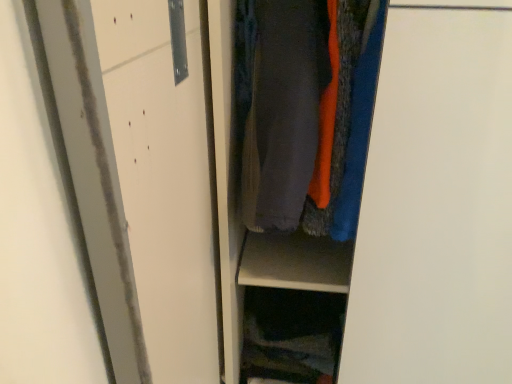
Measure the distance between point (x=246, y=152) and camera.

They are 27.76 inches apart.

Describe the element at coordinates (284, 112) in the screenshot. I see `dark gray fabric at center` at that location.

At what (x,y) coordinates should I click in order to perform the action: click on dark gray fabric at center. Please return your answer as a coordinate pair (x, y). Looking at the image, I should click on (284, 112).

This screenshot has width=512, height=384. What do you see at coordinates (292, 335) in the screenshot?
I see `dark fabric at lower center` at bounding box center [292, 335].

You are a GUI agent. You are given a task and a screenshot of the screen. Output one action in this format:
    pyautogui.click(x=<x>, y=<y>)
    Task: Click on the dark fabric at lower center
    The height and width of the screenshot is (384, 512).
    Given the screenshot: What is the action you would take?
    pyautogui.click(x=292, y=335)

The width and height of the screenshot is (512, 384). What are the coordinates of `dark gray fabric at center` in the screenshot? It's located at (284, 112).

Considering the positions of objects dark gray fabric at center and dark fabric at lower center in the image provided, who is more to the left, dark gray fabric at center or dark fabric at lower center?

dark fabric at lower center.

Relative to dark fabric at lower center, is dark gray fabric at center in front or behind?

Visually, dark gray fabric at center is located in front of dark fabric at lower center.

Which is behind, point (309, 97) or point (308, 339)?

The point (308, 339) is farther.

From the image's perspective, does dark gray fabric at center appear higher than dark fabric at lower center?

→ Indeed, from the image's perspective, dark gray fabric at center is shown above dark fabric at lower center.

From a real-world perspective, does dark gray fabric at center sit lower than dark fabric at lower center?

No, from a real-world perspective, dark gray fabric at center is not below dark fabric at lower center.

Is dark gray fabric at center thinner than dark fabric at lower center?

No.

From their relative heights in the image, would you say dark gray fabric at center is taller or shorter than dark fabric at lower center?

dark gray fabric at center is taller than dark fabric at lower center.

Considering the relative sizes of dark gray fabric at center and dark fabric at lower center in the image provided, is dark gray fabric at center bigger than dark fabric at lower center?

Indeed, dark gray fabric at center has a larger size compared to dark fabric at lower center.

Is dark gray fabric at center surrounding dark fabric at lower center?

Actually, dark fabric at lower center is outside dark gray fabric at center.

Does dark gray fabric at center touch dark fabric at lower center?

→ There is a gap between dark gray fabric at center and dark fabric at lower center.

Consider the image. Is dark gray fabric at center facing away from dark fabric at lower center?

dark gray fabric at center does not have its back to dark fabric at lower center.

I want to click on cabinet below the dark gray fabric at center (from the image's perspective), so click(x=292, y=335).

In the image, is dark fabric at lower center on the left side or the right side of dark gray fabric at center?

Clearly, dark fabric at lower center is on the left of dark gray fabric at center in the image.

Is dark fabric at lower center in front of or behind dark gray fabric at center in the image?

dark fabric at lower center is positioned farther from the viewer than dark gray fabric at center.

Is point (248, 330) behind point (314, 154)?

Yes, it is behind point (314, 154).

From the image's perspective, is dark fabric at lower center located above or below dark gray fabric at center?

From the image's perspective, dark fabric at lower center appears below dark gray fabric at center.

From a real-world perspective, which object rests below the other?

dark fabric at lower center.

Considering the sizes of dark fabric at lower center and dark gray fabric at center in the image, is dark fabric at lower center wider or thinner than dark gray fabric at center?

In the image, dark fabric at lower center appears to be more narrow than dark gray fabric at center.

Considering the relative sizes of dark fabric at lower center and dark gray fabric at center in the image provided, is dark fabric at lower center taller than dark gray fabric at center?

Incorrect, the height of dark fabric at lower center is not larger of that of dark gray fabric at center.

Who is smaller, dark fabric at lower center or dark gray fabric at center?

dark fabric at lower center is smaller.

Is dark fabric at lower center situated inside dark gray fabric at center or outside?

dark fabric at lower center lies outside dark gray fabric at center.

Are dark fabric at lower center and dark gray fabric at center making contact?

No, dark fabric at lower center is not beside dark gray fabric at center.

Could you tell me if dark fabric at lower center is facing dark gray fabric at center?

No, dark fabric at lower center is not aimed at dark gray fabric at center.

How far apart are dark fabric at lower center and dark gray fabric at center?

dark fabric at lower center and dark gray fabric at center are 15.96 inches apart from each other.

Image resolution: width=512 pixels, height=384 pixels. I want to click on cabinet that appears on the left of dark gray fabric at center, so click(292, 335).

Find the location of a particular element. This screenshot has height=384, width=512. garment above the dark fabric at lower center (from a real-world perspective) is located at coordinates (284, 112).

This screenshot has width=512, height=384. I want to click on cabinet on the left of the dark gray fabric at center, so click(x=292, y=335).